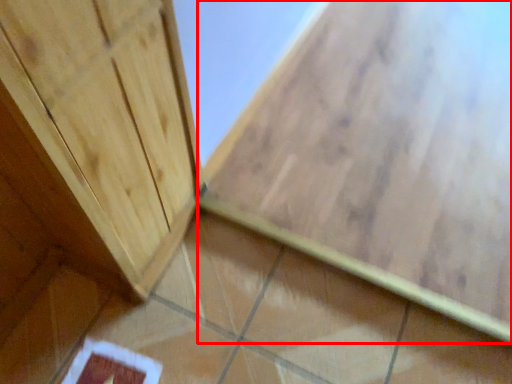
Question: From the image's perspective, what is the correct spatial positioning of ceramic tile (annotated by the red box) in reference to ceramic tile?

Choices:
 (A) above
 (B) below

Answer: (A)